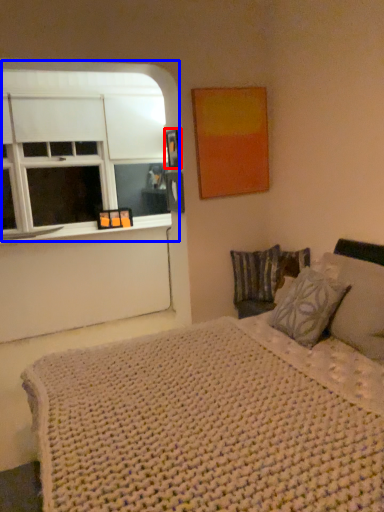
Question: Which point is closer to the camera, picture frame (highlighted by a red box) or window (highlighted by a blue box)?

Choices:
 (A) picture frame
 (B) window

Answer: (A)